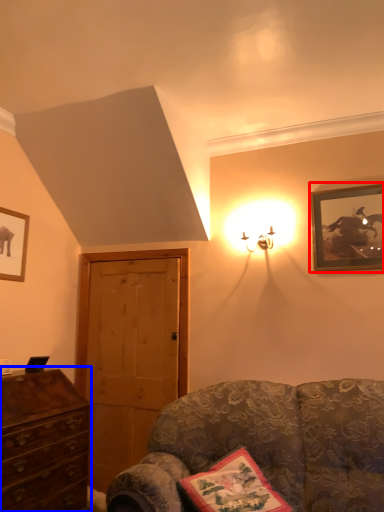
Question: Which of the following is the farthest to the observer, picture frame (highlighted by a red box) or chest of drawers (highlighted by a blue box)?

Choices:
 (A) picture frame
 (B) chest of drawers

Answer: (A)